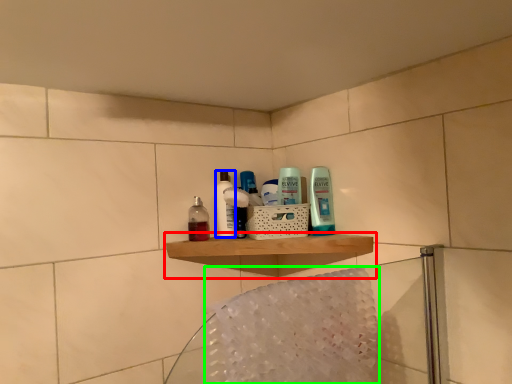
Question: Based on their relative distances, which object is nearer to shelf (highlighted by a red box)? Choose from toiletry (highlighted by a blue box) and bath towel (highlighted by a green box).

Choices:
 (A) toiletry
 (B) bath towel

Answer: (A)